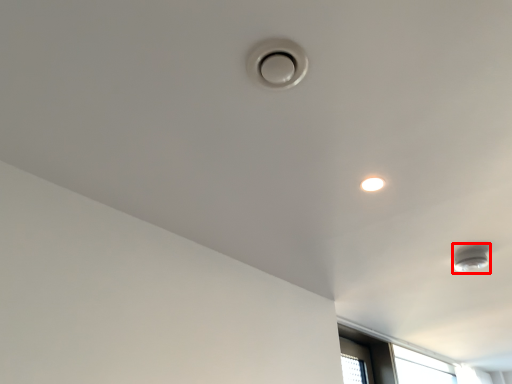
Question: From the image's perspective, what is the correct spatial positioning of lamp (annotated by the red box) in reference to droplight?

Choices:
 (A) below
 (B) above

Answer: (A)